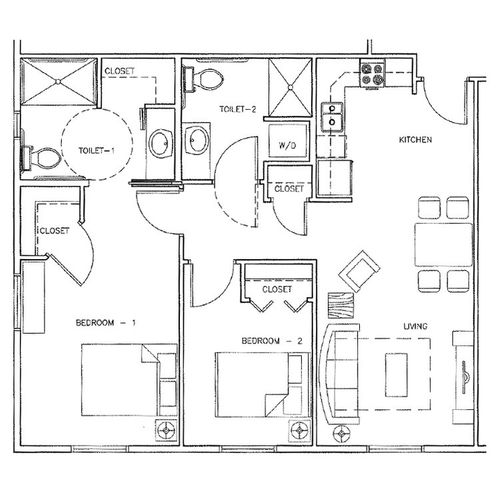
In order to click on toilets in this screenshot , I will do `click(208, 73)`, `click(47, 157)`.